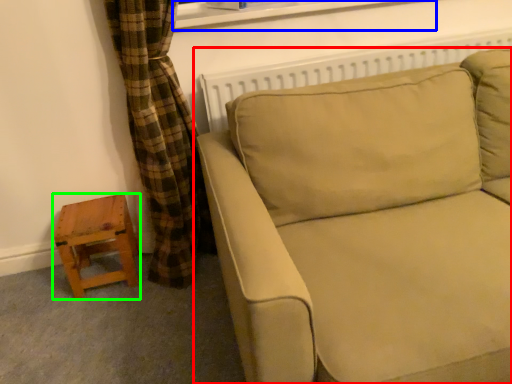
Question: Which object is positioned closest to studio couch (highlighted by a red box)? Select from window frame (highlighted by a blue box) and stool (highlighted by a green box).

Choices:
 (A) window frame
 (B) stool

Answer: (A)